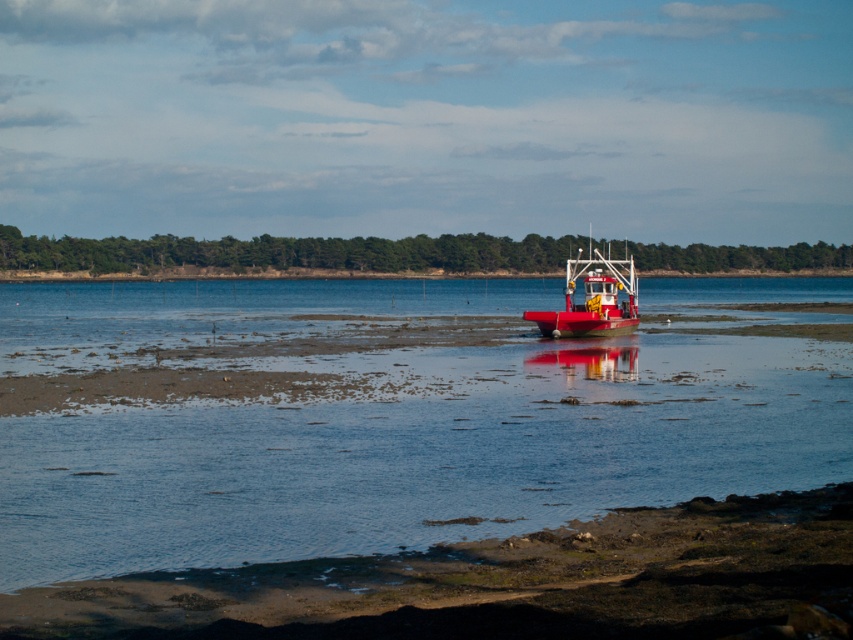
You are standing on the muddy shoreline and want to cross to the other side of the shiny red boat at center. According to the scene, which direction should you walk to avoid the clear water at center?

You should walk to the right of the shiny red boat at center to avoid the clear water at center, since the clear water at center is located to the left of the shiny red boat at center.

You are a photographer standing on the shore and want to take a picture of the shiny red boat at center. You notice the brown sandy mud at lower center is blocking your view. Can you move to the right to get a clear shot of the boat without the mud in the frame?

The brown sandy mud at lower center is in front of the shiny red boat at center, so moving to the right might allow you to position yourself where the mud is no longer blocking the view of the boat.

You are a photographer trying to capture the shiny red boat at center from the brown sandy mud at lower center. Considering their heights, would you need to stand on something to get a better view of the boat?

The brown sandy mud at lower center has a lesser height compared to the shiny red boat at center, so you would need to stand on something to elevate your position and get a better view of the shiny red boat at center.